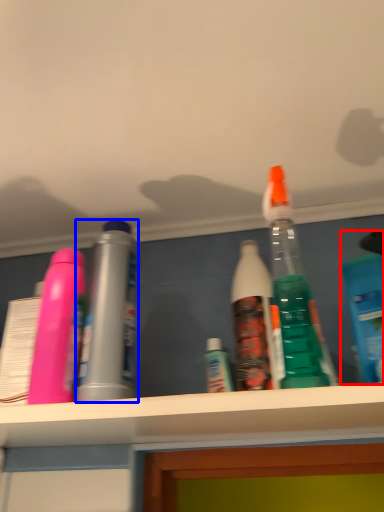
Question: Which object is closer to the camera taking this photo, bottle (highlighted by a red box) or bottle (highlighted by a blue box)?

Choices:
 (A) bottle
 (B) bottle

Answer: (A)